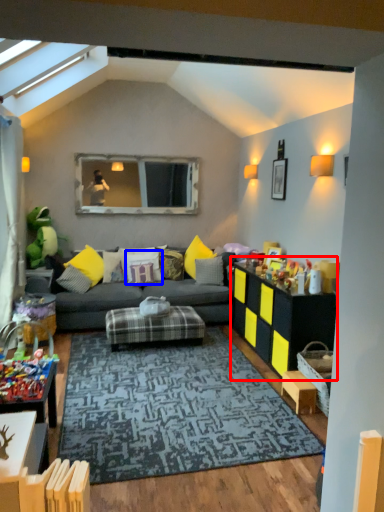
Question: Which object is closer to the camera taking this photo, table (highlighted by a red box) or pillow (highlighted by a blue box)?

Choices:
 (A) table
 (B) pillow

Answer: (A)